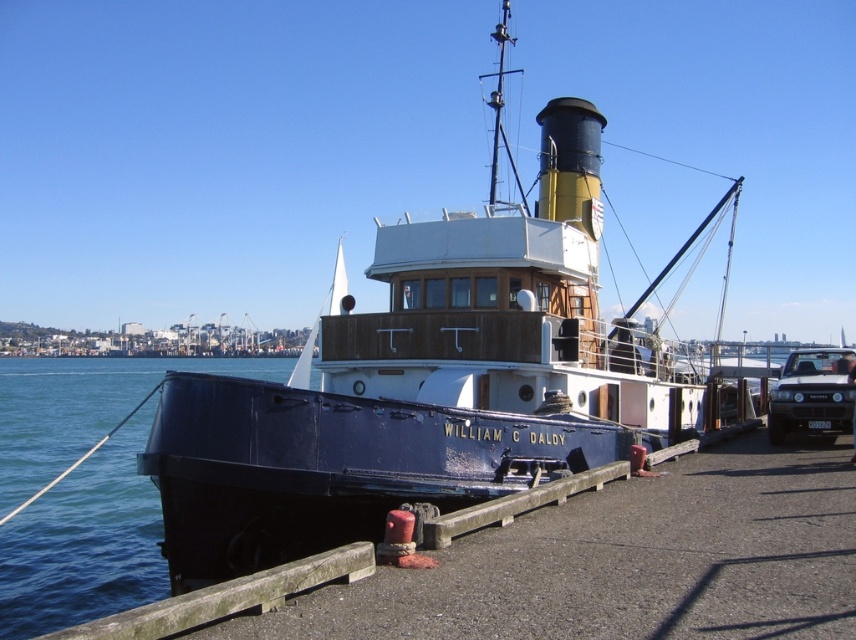
You are planning to transport both the blue polished wood boat at center and the matte black car at right onto a flatbed truck. The truck can only carry one vehicle at a time. Based on their sizes, which vehicle should be loaded first to ensure proper placement on the truck?

The blue polished wood boat at center is bigger than the matte black car at right, so it should be loaded first to ensure there is enough space for it on the flatbed truck.